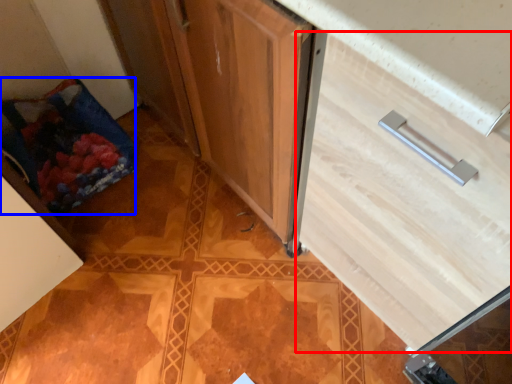
Question: Which of the following is the closest to the observer, drawer (highlighted by a red box) or material (highlighted by a blue box)?

Choices:
 (A) drawer
 (B) material

Answer: (A)